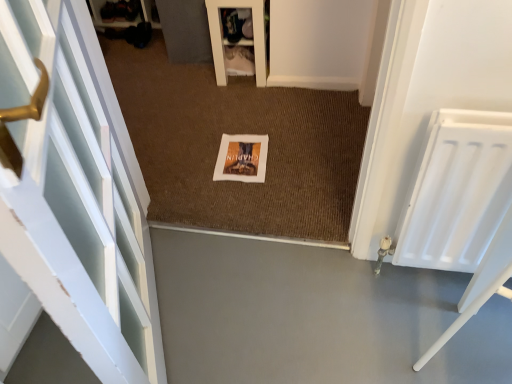
Find the location of a particular element. free point in front of white matte radiator at right is located at coordinates (444, 325).